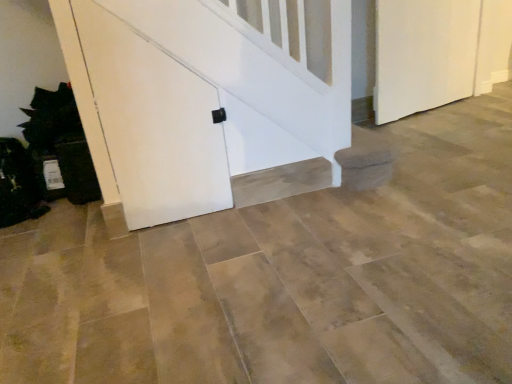
Describe the element at coordinates (204, 94) in the screenshot. The height and width of the screenshot is (384, 512). I see `white matte door at center, arranged as the 1th door when viewed from the left` at that location.

In the scene shown: Measure the distance between white matte door at center, placed as the 2th door when sorted from right to left, and camera.

white matte door at center, placed as the 2th door when sorted from right to left, and camera are 4.73 feet apart.

What are the coordinates of `white matte door at center, placed as the 2th door when sorted from right to left` in the screenshot? It's located at (204, 94).

Where is `white matte door at right, the 1th door viewed from the right`? white matte door at right, the 1th door viewed from the right is located at coordinates (423, 55).

What is the approximate width of white matte door at right, the second door in the front-to-back sequence?

The width of white matte door at right, the second door in the front-to-back sequence, is 6.37 inches.

Describe the element at coordinates (423, 55) in the screenshot. Image resolution: width=512 pixels, height=384 pixels. I see `white matte door at right, the first door positioned from the back` at that location.

This screenshot has height=384, width=512. Find the location of `white matte door at center, acting as the 2th door starting from the back`. white matte door at center, acting as the 2th door starting from the back is located at coordinates (204, 94).

Does white matte door at right, which is counted as the 2th door, starting from the left, appear on the right side of white matte door at center, arranged as the 1th door when viewed from the front?

Indeed, white matte door at right, which is counted as the 2th door, starting from the left, is positioned on the right side of white matte door at center, arranged as the 1th door when viewed from the front.

Is white matte door at right, which is counted as the 2th door, starting from the left, closer to the viewer compared to white matte door at center, placed as the 2th door when sorted from right to left?

That is False.

Considering the points (447, 37) and (163, 187), which point is in front, point (447, 37) or point (163, 187)?

Positioned in front is point (163, 187).

From the image's perspective, which is above, white matte door at right, which is counted as the 2th door, starting from the left, or white matte door at center, acting as the 2th door starting from the back?

white matte door at right, which is counted as the 2th door, starting from the left.

From a real-world perspective, is white matte door at right, which is counted as the 2th door, starting from the left, below white matte door at center, arranged as the 1th door when viewed from the left?

Yes, from a real-world perspective, white matte door at right, which is counted as the 2th door, starting from the left, is under white matte door at center, arranged as the 1th door when viewed from the left.

Does white matte door at right, which is counted as the 2th door, starting from the left, have a greater width compared to white matte door at center, placed as the 2th door when sorted from right to left?

Yes, white matte door at right, which is counted as the 2th door, starting from the left, is wider than white matte door at center, placed as the 2th door when sorted from right to left.

Who is taller, white matte door at right, the 1th door viewed from the right, or white matte door at center, placed as the 2th door when sorted from right to left?

Standing taller between the two is white matte door at center, placed as the 2th door when sorted from right to left.

Between white matte door at right, the second door in the front-to-back sequence, and white matte door at center, arranged as the 1th door when viewed from the left, which one has larger size?

With larger size is white matte door at right, the second door in the front-to-back sequence.

Is white matte door at right, which is counted as the 2th door, starting from the left, positioned beyond the bounds of white matte door at center, arranged as the 1th door when viewed from the front?

Absolutely, white matte door at right, which is counted as the 2th door, starting from the left, is external to white matte door at center, arranged as the 1th door when viewed from the front.

Are white matte door at right, the second door in the front-to-back sequence, and white matte door at center, arranged as the 1th door when viewed from the left, located far from each other?

Yes.

Could you tell me if white matte door at right, the first door positioned from the back, is turned towards white matte door at center, placed as the 2th door when sorted from right to left?

No.

How many degrees apart are the facing directions of white matte door at right, the second door in the front-to-back sequence, and white matte door at center, arranged as the 1th door when viewed from the left?

white matte door at right, the second door in the front-to-back sequence, and white matte door at center, arranged as the 1th door when viewed from the left, are facing 11 degrees away from each other.

The width and height of the screenshot is (512, 384). I want to click on door lying behind the white matte door at center, arranged as the 1th door when viewed from the front, so click(x=423, y=55).

Considering the relative positions of white matte door at center, arranged as the 1th door when viewed from the left, and white matte door at right, which is counted as the 2th door, starting from the left, in the image provided, is white matte door at center, arranged as the 1th door when viewed from the left, to the left or to the right of white matte door at right, which is counted as the 2th door, starting from the left,?

white matte door at center, arranged as the 1th door when viewed from the left, is positioned on white matte door at right, which is counted as the 2th door, starting from the left,'s left side.

In the image, is white matte door at center, arranged as the 1th door when viewed from the left, positioned in front of or behind white matte door at right, the 1th door viewed from the right?

Clearly, white matte door at center, arranged as the 1th door when viewed from the left, is in front of white matte door at right, the 1th door viewed from the right.

Is point (226, 161) in front of point (398, 58)?

Yes.

From the image's perspective, between white matte door at center, acting as the 2th door starting from the back, and white matte door at right, the first door positioned from the back, which one is located above?

white matte door at right, the first door positioned from the back, is shown above in the image.

From a real-world perspective, between white matte door at center, arranged as the 1th door when viewed from the left, and white matte door at right, the first door positioned from the back, who is vertically lower?

In real-world perspective, white matte door at right, the first door positioned from the back, is lower.

Does white matte door at center, arranged as the 1th door when viewed from the front, have a lesser width compared to white matte door at right, which is counted as the 2th door, starting from the left?

Yes.

Who is shorter, white matte door at center, arranged as the 1th door when viewed from the left, or white matte door at right, the 1th door viewed from the right?

white matte door at right, the 1th door viewed from the right.

Is white matte door at center, acting as the 2th door starting from the back, bigger than white matte door at right, the first door positioned from the back?

No, white matte door at center, acting as the 2th door starting from the back, is not bigger than white matte door at right, the first door positioned from the back.

Could white matte door at right, which is counted as the 2th door, starting from the left, be considered to be inside white matte door at center, placed as the 2th door when sorted from right to left?

No, white matte door at center, placed as the 2th door when sorted from right to left, does not contain white matte door at right, which is counted as the 2th door, starting from the left.

Is white matte door at center, acting as the 2th door starting from the back, far from white matte door at right, the 1th door viewed from the right?

Yes, white matte door at center, acting as the 2th door starting from the back, and white matte door at right, the 1th door viewed from the right, are located far from each other.

Could you tell me if white matte door at center, arranged as the 1th door when viewed from the left, is facing white matte door at right, which is counted as the 2th door, starting from the left?

No, white matte door at center, arranged as the 1th door when viewed from the left, is not turned towards white matte door at right, which is counted as the 2th door, starting from the left.

Based on the photo, what's the angular difference between white matte door at center, placed as the 2th door when sorted from right to left, and white matte door at right, the second door in the front-to-back sequence,'s facing directions?

white matte door at center, placed as the 2th door when sorted from right to left, and white matte door at right, the second door in the front-to-back sequence, are facing 11 degrees away from each other.

The image size is (512, 384). Find the location of `door lying on the left of white matte door at right, the second door in the front-to-back sequence`. door lying on the left of white matte door at right, the second door in the front-to-back sequence is located at coordinates (204, 94).

Identify the location of door behind the white matte door at center, arranged as the 1th door when viewed from the front. (423, 55).

Find the location of a particular element. Image resolution: width=512 pixels, height=384 pixels. door lying above the white matte door at center, arranged as the 1th door when viewed from the left (from the image's perspective) is located at coordinates (423, 55).